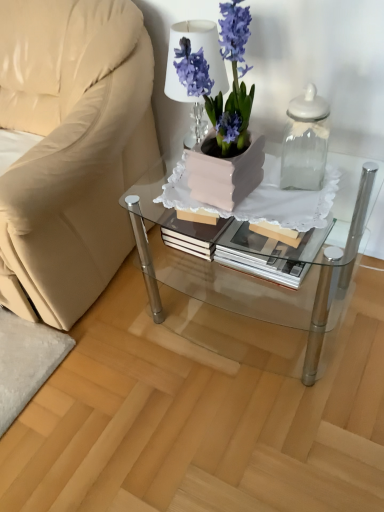
Question: Is the position of white glossy table lamp at upper center less distant than that of clear glass jar at upper right?

Choices:
 (A) no
 (B) yes

Answer: (A)

Question: Is white glossy table lamp at upper center facing away from clear glass jar at upper right?

Choices:
 (A) yes
 (B) no

Answer: (B)

Question: From the image's perspective, does white glossy table lamp at upper center appear higher than clear glass jar at upper right?

Choices:
 (A) no
 (B) yes

Answer: (B)

Question: From a real-world perspective, is white glossy table lamp at upper center located beneath clear glass jar at upper right?

Choices:
 (A) yes
 (B) no

Answer: (B)

Question: From a real-world perspective, is white glossy table lamp at upper center over clear glass jar at upper right?

Choices:
 (A) no
 (B) yes

Answer: (B)

Question: Visually, is clear glass coffee table at center positioned to the left or to the right of clear glass jar at upper right?

Choices:
 (A) left
 (B) right

Answer: (A)

Question: Considering the positions of point pos(294,294) and point pos(294,175), is point pos(294,294) closer or farther from the camera than point pos(294,175)?

Choices:
 (A) closer
 (B) farther

Answer: (B)

Question: Would you say clear glass coffee table at center is inside or outside clear glass jar at upper right?

Choices:
 (A) outside
 (B) inside

Answer: (A)

Question: Considering the positions of clear glass coffee table at center and clear glass jar at upper right in the image, is clear glass coffee table at center wider or thinner than clear glass jar at upper right?

Choices:
 (A) thin
 (B) wide

Answer: (B)

Question: From a real-world perspective, is beige fabric chair at left above or below matte ceramic vase at center?

Choices:
 (A) below
 (B) above

Answer: (A)

Question: From their relative heights in the image, would you say beige fabric chair at left is taller or shorter than matte ceramic vase at center?

Choices:
 (A) tall
 (B) short

Answer: (A)

Question: From the image's perspective, relative to matte ceramic vase at center, is beige fabric chair at left above or below?

Choices:
 (A) below
 (B) above

Answer: (A)

Question: Is beige fabric chair at left wider or thinner than matte ceramic vase at center?

Choices:
 (A) thin
 (B) wide

Answer: (B)

Question: From the image's perspective, is clear glass coffee table at center positioned above or below beige fabric chair at left?

Choices:
 (A) below
 (B) above

Answer: (A)

Question: Is clear glass coffee table at center in front of or behind beige fabric chair at left in the image?

Choices:
 (A) behind
 (B) front

Answer: (A)